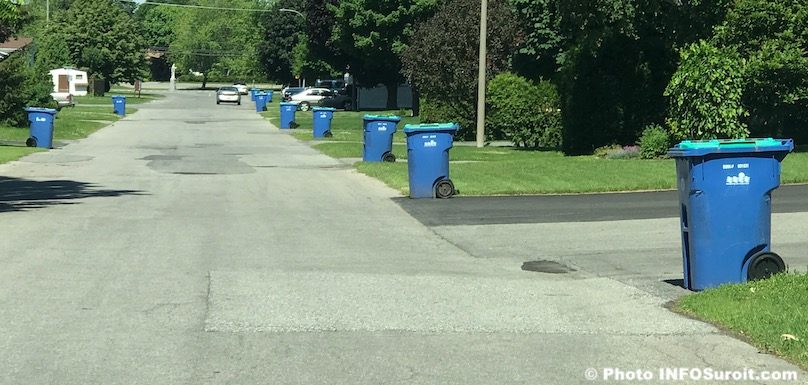
Locate an element on the screen. garbage cans is located at coordinates (727, 204), (427, 157), (381, 139), (325, 120), (287, 112), (262, 100), (268, 91), (253, 89), (120, 100), (36, 122).